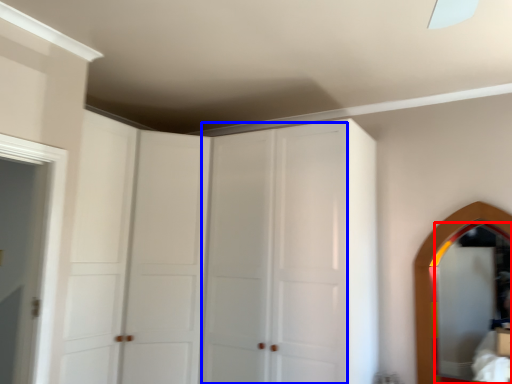
Question: Which of the following is the closest to the observer, mirror (highlighted by a red box) or glass door (highlighted by a blue box)?

Choices:
 (A) mirror
 (B) glass door

Answer: (B)